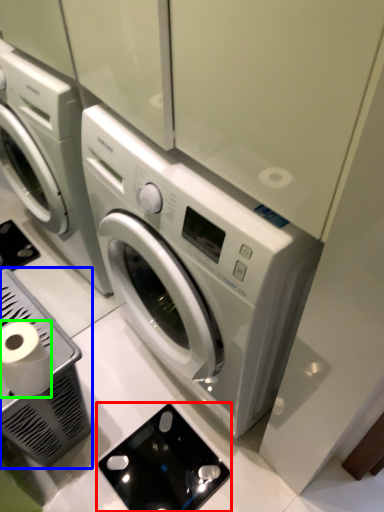
Question: Considering the real-world distances, which object is closest to appliance (highlighted by a red box)? appliance (highlighted by a blue box) or toilet paper (highlighted by a green box).

Choices:
 (A) appliance
 (B) toilet paper

Answer: (A)